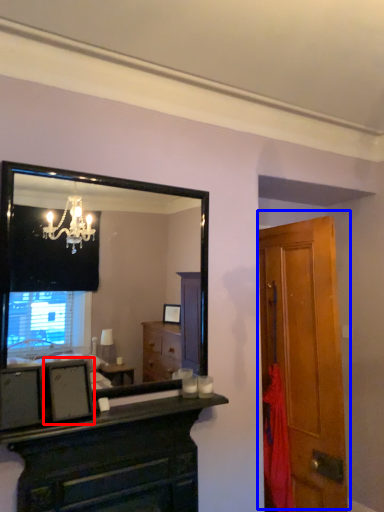
Question: Which object appears farthest to the camera in this image, picture frame (highlighted by a red box) or door (highlighted by a blue box)?

Choices:
 (A) picture frame
 (B) door

Answer: (B)